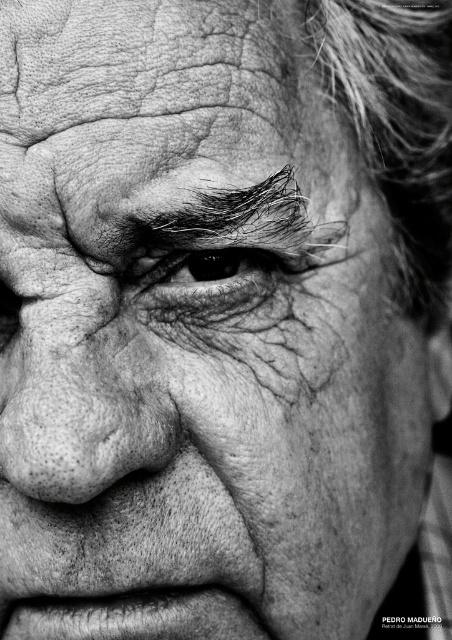
Looking at this image, in the black and white portrait, which object is positioned to the right of the other between the dull skin nose at center and the black textured eye at center?

The black textured eye at center is positioned to the right of the dull skin nose at center.

In the black and white portrait, the dark hair at upper center and the black textured eye at center are both visible. Which object is located to the right of the other?

The dark hair at upper center is positioned on the right side of the black textured eye at center.